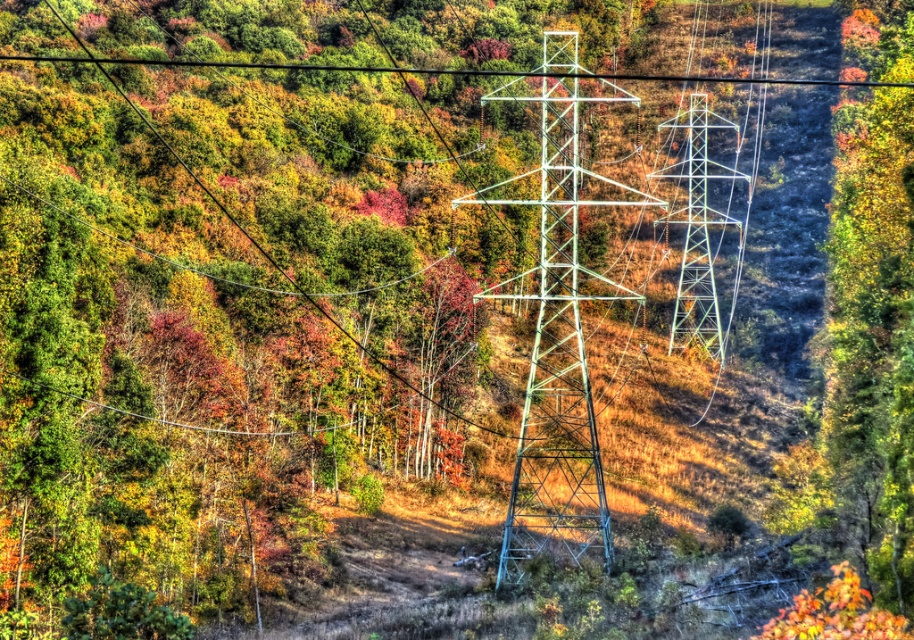
Looking at this image, you are a maintenance worker needing to inspect both the green metallic tower at center and the metallic silver tower at center. Since you can only inspect one tower today, which tower should you prioritize if you want to start from the left side of the scene?

The green metallic tower at center is to the left of the metallic silver tower at center, so you should prioritize inspecting the green metallic tower at center first as it is positioned further to the left.

You are standing in an autumn landscape with two large electrical transmission towers. There is a point at coordinates point (505,83). Can you determine if this point is closer to you or farther away than the towers?

The point point (505,83) is 218.68 meters from the viewer. Since the towers are part of the landscape and the point is at 218.68 meters away, it is likely that the point is farther away than the towers, but without specific tower distances, we can only state the point is 218.68 meters away.

You are an engineer inspecting the two towers in the scene. Which tower, the green metallic tower at center or the metallic silver tower at center, has a larger structure?

The green metallic tower at center is bigger than the metallic silver tower at center.